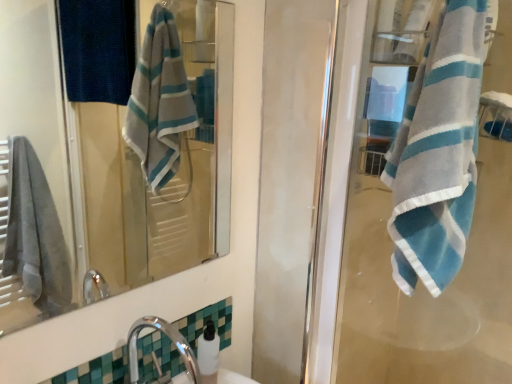
Based on the photo, what is the approximate height of white glossy soap dispenser at lower center?

The height of white glossy soap dispenser at lower center is 18.03 centimeters.

The width and height of the screenshot is (512, 384). I want to click on blue striped towel at right, so click(430, 199).

The image size is (512, 384). I want to click on matte glass mirror at upper center, so click(109, 165).

Locate an element on the screen. This screenshot has height=384, width=512. white glossy soap dispenser at lower center is located at coordinates (208, 354).

Which is less distant, (435, 237) or (232, 47)?

The point (435, 237) is more forward.

Is blue striped towel at right surrounding matte glass mirror at upper center?

Definitely not — matte glass mirror at upper center is not inside blue striped towel at right.

At what (x,y) coordinates should I click in order to perform the action: click on screen door below the matte glass mirror at upper center (from the image's perspective). Please return your answer as a coordinate pair (x, y). Looking at the image, I should click on (430, 199).

Measure the distance between blue striped towel at right and matte glass mirror at upper center.

They are 1.41 meters apart.

Looking at this image, is chrome metallic faucet at lower left in front of or behind white glossy soap dispenser at lower center in the image?

In the image, chrome metallic faucet at lower left appears in front of white glossy soap dispenser at lower center.

Is chrome metallic faucet at lower left in contact with white glossy soap dispenser at lower center?

Yes.

From the image's perspective, is chrome metallic faucet at lower left over white glossy soap dispenser at lower center?

No.

Locate an element on the screen. soap dispenser located behind the chrome metallic faucet at lower left is located at coordinates (208, 354).

How far apart are chrome metallic faucet at lower left and matte glass mirror at upper center?

A distance of 4.38 feet exists between chrome metallic faucet at lower left and matte glass mirror at upper center.

Would you say chrome metallic faucet at lower left is a long distance from matte glass mirror at upper center?

Yes.

Who is bigger, chrome metallic faucet at lower left or matte glass mirror at upper center?

With larger size is chrome metallic faucet at lower left.

From the image's perspective, between chrome metallic faucet at lower left and matte glass mirror at upper center, who is located below?

chrome metallic faucet at lower left appears lower in the image.

Is matte glass mirror at upper center facing towards white glossy soap dispenser at lower center?

No.

Which of these two, matte glass mirror at upper center or white glossy soap dispenser at lower center, is wider?

white glossy soap dispenser at lower center is wider.

Do you think matte glass mirror at upper center is within white glossy soap dispenser at lower center, or outside of it?

matte glass mirror at upper center is not enclosed by white glossy soap dispenser at lower center.

Are matte glass mirror at upper center and white glossy soap dispenser at lower center beside each other?

No, matte glass mirror at upper center is not making contact with white glossy soap dispenser at lower center.

From the image's perspective, does matte glass mirror at upper center appear lower than blue striped towel at right?

No.

Consider the image. In terms of height, does matte glass mirror at upper center look taller or shorter compared to blue striped towel at right?

Considering their sizes, matte glass mirror at upper center has more height than blue striped towel at right.

In the scene shown: Would you say matte glass mirror at upper center is outside blue striped towel at right?

Yes, matte glass mirror at upper center is located beyond the bounds of blue striped towel at right.

Between matte glass mirror at upper center and blue striped towel at right, which one has smaller width?

matte glass mirror at upper center.

Would you say blue striped towel at right is to the left or to the right of chrome metallic faucet at lower left in the picture?

Based on their positions, blue striped towel at right is located to the right of chrome metallic faucet at lower left.

Could you tell me if blue striped towel at right is facing chrome metallic faucet at lower left?

No, blue striped towel at right does not turn towards chrome metallic faucet at lower left.

From the image's perspective, would you say blue striped towel at right is positioned over chrome metallic faucet at lower left?

Yes, from the image's perspective, blue striped towel at right is on top of chrome metallic faucet at lower left.

Looking at the image, does blue striped towel at right seem bigger or smaller compared to chrome metallic faucet at lower left?

In the image, blue striped towel at right appears to be larger than chrome metallic faucet at lower left.

From a real-world perspective, does white glossy soap dispenser at lower center sit lower than matte glass mirror at upper center?

Yes, from a real-world perspective, white glossy soap dispenser at lower center is beneath matte glass mirror at upper center.

Does white glossy soap dispenser at lower center have a greater height compared to matte glass mirror at upper center?

No, white glossy soap dispenser at lower center is not taller than matte glass mirror at upper center.

The image size is (512, 384). In the image, there is a white glossy soap dispenser at lower center. In order to click on mirror above it (from the image's perspective) in this screenshot , I will do `click(109, 165)`.

Based on the photo, is the surface of white glossy soap dispenser at lower center in direct contact with matte glass mirror at upper center?

No, white glossy soap dispenser at lower center is not making contact with matte glass mirror at upper center.

This screenshot has width=512, height=384. What are the coordinates of `screen door below the matte glass mirror at upper center (from the image's perspective)` in the screenshot? It's located at (430, 199).

Locate an element on the screen. faucet on the left of the white glossy soap dispenser at lower center is located at coordinates (170, 339).

When comparing their distances from chrome metallic faucet at lower left, does blue striped towel at right or matte glass mirror at upper center seem further?

matte glass mirror at upper center lies further to chrome metallic faucet at lower left than the other object.

Estimate the real-world distances between objects in this image. Which object is closer to white glossy soap dispenser at lower center, blue striped towel at right or matte glass mirror at upper center?

blue striped towel at right is positioned closer to the anchor white glossy soap dispenser at lower center.

Considering their positions, is chrome metallic faucet at lower left positioned further to blue striped towel at right than white glossy soap dispenser at lower center?

chrome metallic faucet at lower left is positioned further to the anchor blue striped towel at right.

Estimate the real-world distances between objects in this image. Which object is closer to chrome metallic faucet at lower left, white glossy soap dispenser at lower center or blue striped towel at right?

white glossy soap dispenser at lower center.

Which object lies further to the anchor point matte glass mirror at upper center, white glossy soap dispenser at lower center or chrome metallic faucet at lower left?

Among the two, white glossy soap dispenser at lower center is located further to matte glass mirror at upper center.

Estimate the real-world distances between objects in this image. Which object is further from blue striped towel at right, white glossy soap dispenser at lower center or matte glass mirror at upper center?

matte glass mirror at upper center lies further to blue striped towel at right than the other object.

Which object lies nearer to the anchor point chrome metallic faucet at lower left, matte glass mirror at upper center or blue striped towel at right?

blue striped towel at right.

Which object lies nearer to the anchor point blue striped towel at right, matte glass mirror at upper center or white glossy soap dispenser at lower center?

Based on the image, white glossy soap dispenser at lower center appears to be nearer to blue striped towel at right.

The image size is (512, 384). Find the location of `soap dispenser between blue striped towel at right and chrome metallic faucet at lower left vertically`. soap dispenser between blue striped towel at right and chrome metallic faucet at lower left vertically is located at coordinates (208, 354).

Locate an element on the screen. soap dispenser located between matte glass mirror at upper center and blue striped towel at right in the left-right direction is located at coordinates (208, 354).

The image size is (512, 384). I want to click on soap dispenser between matte glass mirror at upper center and chrome metallic faucet at lower left vertically, so click(x=208, y=354).

Locate an element on the screen. This screenshot has width=512, height=384. faucet situated between matte glass mirror at upper center and blue striped towel at right from left to right is located at coordinates (170, 339).